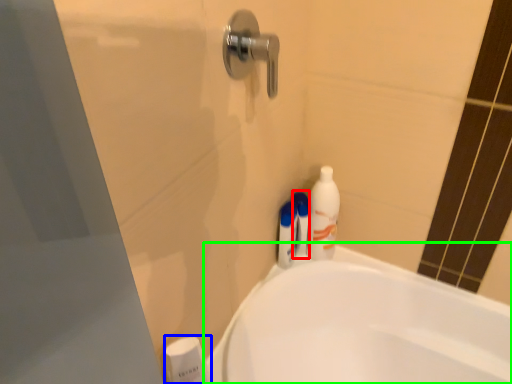
Question: Estimate the real-world distances between objects in this image. Which object is closer to shaving cream (highlighted by a red box), toiletry (highlighted by a blue box) or bathtub (highlighted by a green box)?

Choices:
 (A) toiletry
 (B) bathtub

Answer: (B)